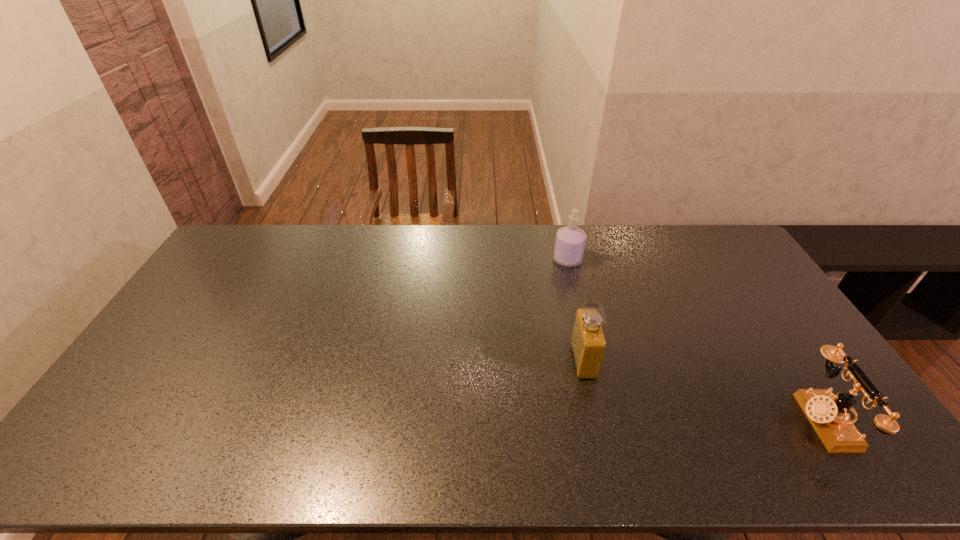
Locate an element on the screen. Image resolution: width=960 pixels, height=540 pixels. object at the far edge is located at coordinates (570, 241).

The image size is (960, 540). Find the location of `object that is positioned at the near edge`. object that is positioned at the near edge is located at coordinates (829, 415).

Locate an element on the screen. The width and height of the screenshot is (960, 540). object located in the right edge section of the desktop is located at coordinates (829, 415).

Where is `object present at the near right corner`? object present at the near right corner is located at coordinates (829, 415).

In the image, there is a desktop. Where is `vacant space at the far edge`? The image size is (960, 540). vacant space at the far edge is located at coordinates (262, 257).

In the image, there is a desktop. Identify the location of vacant space at the near edge. (796, 471).

Where is `vacant space at the left edge of the desktop`? This screenshot has height=540, width=960. vacant space at the left edge of the desktop is located at coordinates (189, 300).

The height and width of the screenshot is (540, 960). I want to click on free region at the far right corner of the desktop, so click(x=717, y=248).

Identify the location of free spot between the farther perfume and the telephone. Image resolution: width=960 pixels, height=540 pixels. (695, 340).

Locate an element on the screen. The height and width of the screenshot is (540, 960). empty space that is in between the rightmost object and the nearer perfume is located at coordinates (703, 390).